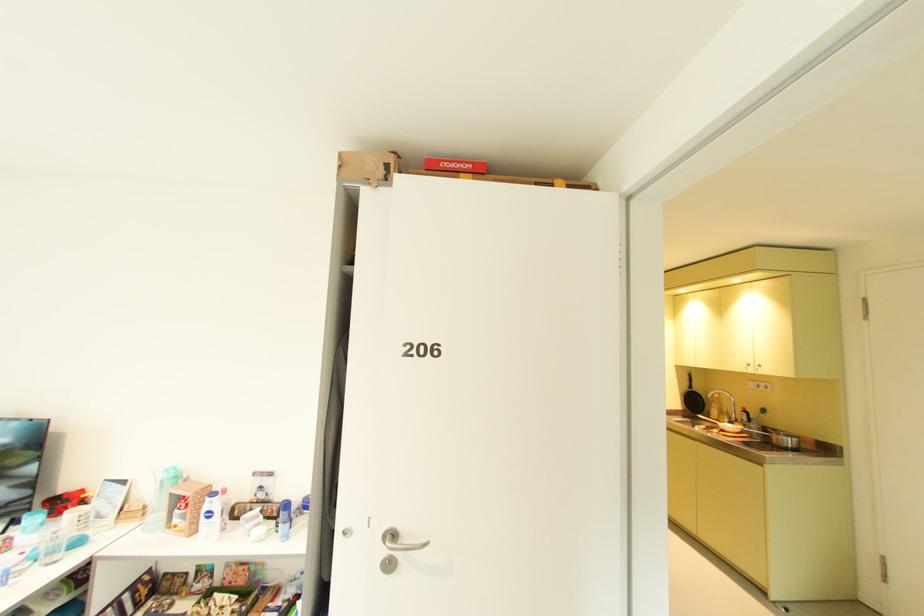
Where would you turn the silver door handle? Please return your answer as a coordinate pair (x, y).

(405, 546)